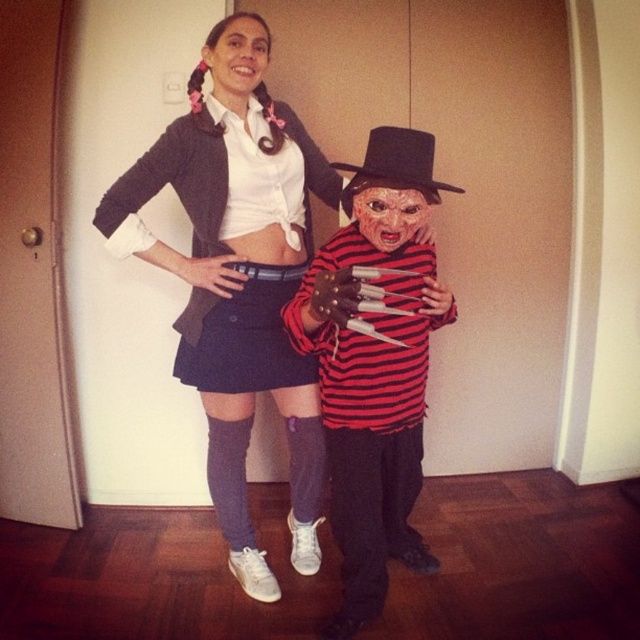
You are a costume designer analyzing the image. You need to determine the spatial relationship between the red striped shirt at center and the smooth plastic mask at center. Which object is positioned lower in the image?

The red striped shirt at center is positioned below the smooth plastic mask at center, so the red striped shirt at center is lower in the image.

You are an interior designer assessing the placement of two items in a room. The matte black jacket at upper center and the red striped shirt at center are both hanging on a wall. Given their sizes, which one would you recommend placing lower to ensure they are both visible without overlapping?

The red striped shirt at center is shorter than the matte black jacket at upper center, so placing it lower would prevent overlap while keeping both visible.

You are designing a display case for a costume shop that needs to accommodate both the matte black jacket at upper center and the smooth plastic mask at center. Given their sizes, which object requires more horizontal space in the display?

The matte black jacket at upper center requires more horizontal space in the display because its width surpasses that of the smooth plastic mask at center.